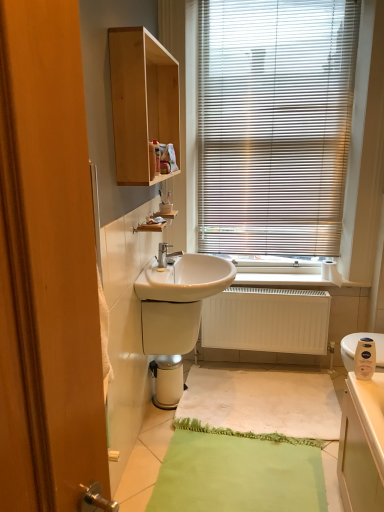
Where is `free point above white matte radiator at lower center (from a real-world perspective)`? This screenshot has width=384, height=512. free point above white matte radiator at lower center (from a real-world perspective) is located at coordinates (278, 292).